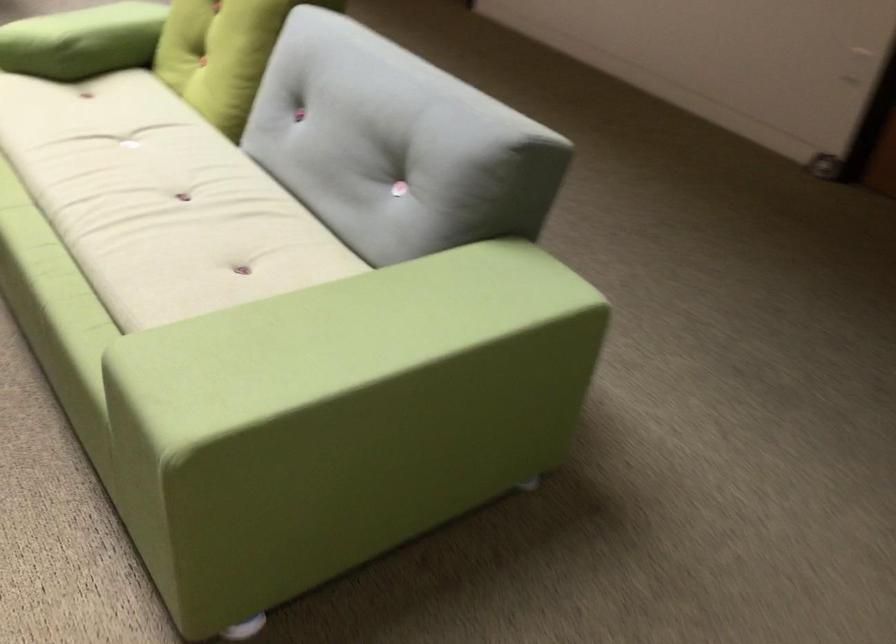
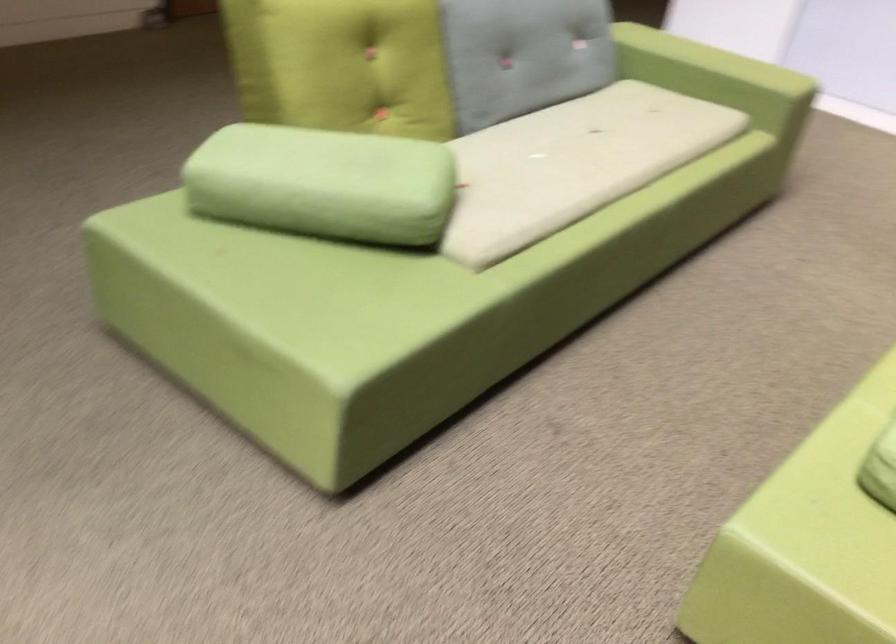
Where in the second image is the point corresponding to (x=244, y=299) from the first image?

(717, 77)